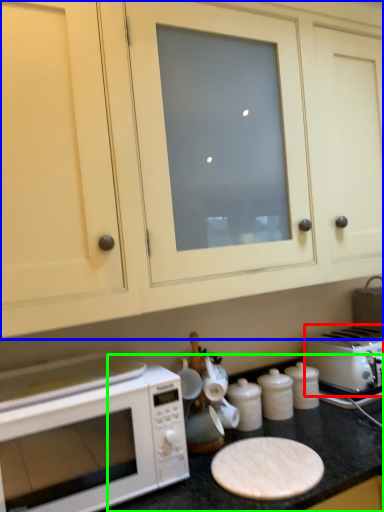
Question: Estimate the real-world distances between objects in this image. Which object is farther from toaster (highlighted by a red box), cabinetry (highlighted by a blue box) or counter top (highlighted by a green box)?

Choices:
 (A) cabinetry
 (B) counter top

Answer: (A)